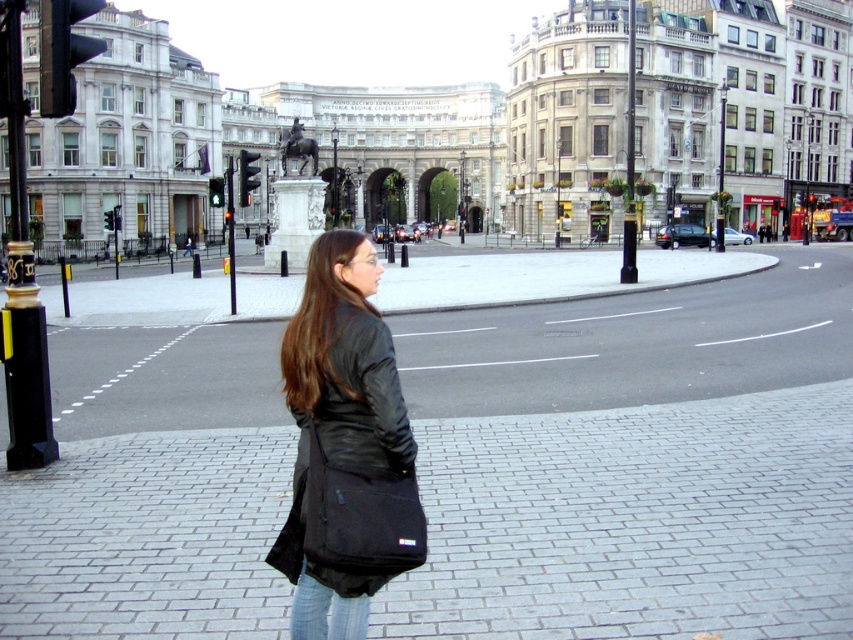
Question: Can you confirm if black leather jacket at center is bigger than metallic pole at center?

Choices:
 (A) yes
 (B) no

Answer: (B)

Question: Which object is closer to the camera taking this photo?

Choices:
 (A) black polished metal pole at left
 (B) metallic pole at center
 (C) jeans at lower center

Answer: (C)

Question: In this image, where is jeans at lower center located relative to black metal pole at center?

Choices:
 (A) below
 (B) above

Answer: (A)

Question: Is black leather jacket at center bigger than black polished metal pole at left?

Choices:
 (A) no
 (B) yes

Answer: (B)

Question: Which point is closer to the camera taking this photo?

Choices:
 (A) (633, 564)
 (B) (20, 273)
 (C) (227, 221)

Answer: (A)

Question: Which point appears closest to the camera in this image?

Choices:
 (A) (15, 460)
 (B) (231, 250)
 (C) (364, 595)
 (D) (630, 84)

Answer: (C)